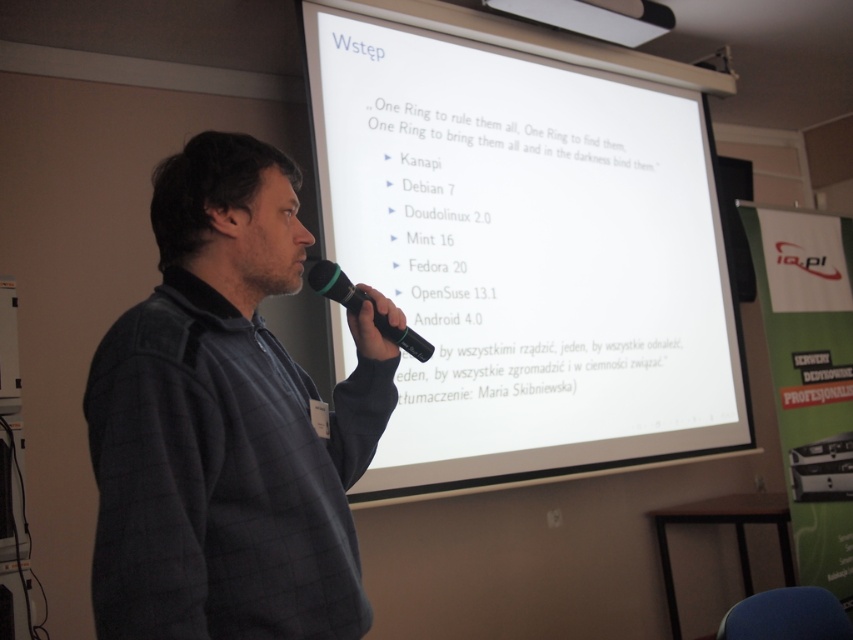
Question: Which point is farther to the camera?

Choices:
 (A) (331, 298)
 (B) (672, 224)
 (C) (178, 308)

Answer: (B)

Question: Considering the real-world distances, which object is closest to the black rubber microphone at center?

Choices:
 (A) white matte projection screen at upper center
 (B) dark gray sweater at center

Answer: (B)

Question: Which object appears farthest from the camera in this image?

Choices:
 (A) white matte projection screen at upper center
 (B) black rubber microphone at center

Answer: (A)

Question: Does white matte projection screen at upper center appear on the right side of black rubber microphone at center?

Choices:
 (A) no
 (B) yes

Answer: (B)

Question: Does white matte projection screen at upper center appear on the right side of black rubber microphone at center?

Choices:
 (A) no
 (B) yes

Answer: (B)

Question: In this image, where is dark gray sweater at center located relative to black rubber microphone at center?

Choices:
 (A) below
 (B) above

Answer: (A)